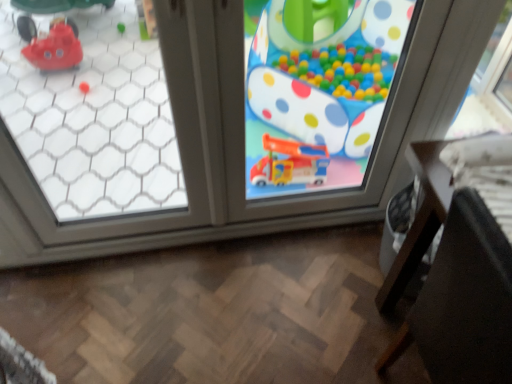
Describe the element at coordinates (94, 119) in the screenshot. I see `transparent glass window at upper left, placed as the 2th window when sorted from right to left` at that location.

The image size is (512, 384). What do you see at coordinates (319, 91) in the screenshot?
I see `matte plastic toy at center` at bounding box center [319, 91].

What do you see at coordinates (464, 302) in the screenshot? I see `black leather chair at lower right` at bounding box center [464, 302].

Where is `transparent glass window at upper left, placed as the 2th window when sorted from right to left`? Image resolution: width=512 pixels, height=384 pixels. transparent glass window at upper left, placed as the 2th window when sorted from right to left is located at coordinates (94, 119).

From a real-world perspective, who is located lower, transparent glass window at upper left, placed as the 2th window when sorted from right to left, or black leather chair at lower right?

black leather chair at lower right, from a real-world perspective.

Relative to black leather chair at lower right, is transparent glass window at upper left, which is the first window from left to right, in front or behind?

In the image, transparent glass window at upper left, which is the first window from left to right, appears behind black leather chair at lower right.

Looking at this image, who is shorter, transparent glass window at upper left, which is the first window from left to right, or black leather chair at lower right?

Standing shorter between the two is black leather chair at lower right.

Could black leather chair at lower right be considered to be inside transparent glass window at center, the second window in the left-to-right sequence?

Actually, black leather chair at lower right is outside transparent glass window at center, the second window in the left-to-right sequence.

From a real-world perspective, is transparent glass window at center, the 1th window when ordered from right to left, positioned under black leather chair at lower right based on gravity?

No, from a real-world perspective, transparent glass window at center, the 1th window when ordered from right to left, is not below black leather chair at lower right.

In the scene shown: Is transparent glass window at center, the second window in the left-to-right sequence, oriented away from black leather chair at lower right?

No, transparent glass window at center, the second window in the left-to-right sequence, is not facing away from black leather chair at lower right.

Based on the photo, considering the relative positions of black leather chair at lower right and transparent glass window at upper left, placed as the 2th window when sorted from right to left, in the image provided, is black leather chair at lower right to the left or to the right of transparent glass window at upper left, placed as the 2th window when sorted from right to left,?

In the image, black leather chair at lower right appears on the right side of transparent glass window at upper left, placed as the 2th window when sorted from right to left.

Which of these two, black leather chair at lower right or transparent glass window at upper left, placed as the 2th window when sorted from right to left, is thinner?

With smaller width is transparent glass window at upper left, placed as the 2th window when sorted from right to left.

In the scene shown: Would you say transparent glass window at upper left, placed as the 2th window when sorted from right to left, is part of black leather chair at lower right's contents?

Actually, transparent glass window at upper left, placed as the 2th window when sorted from right to left, is outside black leather chair at lower right.

From the image's perspective, which one is positioned higher, black leather chair at lower right or transparent glass window at upper left, placed as the 2th window when sorted from right to left?

transparent glass window at upper left, placed as the 2th window when sorted from right to left, from the image's perspective.

Can you confirm if transparent glass window at upper left, which is the first window from left to right, is positioned to the right of matte plastic toy at center?

Incorrect, transparent glass window at upper left, which is the first window from left to right, is not on the right side of matte plastic toy at center.

Between transparent glass window at upper left, placed as the 2th window when sorted from right to left, and matte plastic toy at center, which one is positioned in front?

Positioned in front is transparent glass window at upper left, placed as the 2th window when sorted from right to left.

Which is farther, (x=119, y=17) or (x=346, y=67)?

Positioned behind is point (x=119, y=17).

Which of these two, matte plastic toy at center or transparent glass window at upper left, placed as the 2th window when sorted from right to left, is smaller?

With smaller size is transparent glass window at upper left, placed as the 2th window when sorted from right to left.

Which is in front, point (261, 134) or point (48, 194)?

The point (48, 194) is in front.

From the image's perspective, between matte plastic toy at center and transparent glass window at upper left, placed as the 2th window when sorted from right to left, who is located below?

transparent glass window at upper left, placed as the 2th window when sorted from right to left, is shown below in the image.

How distant is matte plastic toy at center from transparent glass window at upper left, which is the first window from left to right?

matte plastic toy at center is 32.87 inches away from transparent glass window at upper left, which is the first window from left to right.

Which point is more distant from viewer, (8, 86) or (438, 11)?

Point (8, 86)

You are a GUI agent. You are given a task and a screenshot of the screen. Output one action in this format:
    pyautogui.click(x=<x>, y=<y>)
    Task: Click on the window in front of the transparent glass window at center, the second window in the left-to-right sequence
    The height and width of the screenshot is (384, 512).
    Given the screenshot: What is the action you would take?
    pyautogui.click(x=94, y=119)

Who is more distant, transparent glass window at upper left, placed as the 2th window when sorted from right to left, or transparent glass window at center, the second window in the left-to-right sequence?

transparent glass window at center, the second window in the left-to-right sequence, is behind.

Would you consider matte plastic toy at center to be distant from black leather chair at lower right?

matte plastic toy at center is positioned a significant distance from black leather chair at lower right.

Between point (303, 57) and point (424, 349), which one is positioned in front?

Point (424, 349)

From a real-world perspective, which is physically below, matte plastic toy at center or black leather chair at lower right?

black leather chair at lower right, from a real-world perspective.

Considering the sizes of objects matte plastic toy at center and black leather chair at lower right in the image provided, who is thinner, matte plastic toy at center or black leather chair at lower right?

matte plastic toy at center is thinner.

Find the location of a particular element. The image size is (512, 384). chair below the transparent glass window at upper left, placed as the 2th window when sorted from right to left (from a real-world perspective) is located at coordinates (464, 302).

The width and height of the screenshot is (512, 384). What are the coordinates of `the 1st window above the black leather chair at lower right (from a real-world perspective)` in the screenshot? It's located at (223, 123).

Looking at the image, which one is located further to transparent glass window at center, the 1th window when ordered from right to left, transparent glass window at upper left, which is the first window from left to right, or black leather chair at lower right?

Based on the image, black leather chair at lower right appears to be further to transparent glass window at center, the 1th window when ordered from right to left.

When comparing their distances from black leather chair at lower right, does transparent glass window at center, the 1th window when ordered from right to left, or matte plastic toy at center seem further?

matte plastic toy at center.

Based on their spatial positions, is matte plastic toy at center or transparent glass window at center, the second window in the left-to-right sequence, closer to transparent glass window at upper left, placed as the 2th window when sorted from right to left?

transparent glass window at center, the second window in the left-to-right sequence, is positioned closer to the anchor transparent glass window at upper left, placed as the 2th window when sorted from right to left.

Based on their spatial positions, is transparent glass window at upper left, which is the first window from left to right, or matte plastic toy at center further from black leather chair at lower right?

transparent glass window at upper left, which is the first window from left to right, lies further to black leather chair at lower right than the other object.

Considering their positions, is matte plastic toy at center positioned closer to black leather chair at lower right than transparent glass window at upper left, which is the first window from left to right?

matte plastic toy at center.

Estimate the real-world distances between objects in this image. Which object is closer to transparent glass window at upper left, which is the first window from left to right, transparent glass window at center, the 1th window when ordered from right to left, or black leather chair at lower right?

transparent glass window at center, the 1th window when ordered from right to left, is positioned closer to the anchor transparent glass window at upper left, which is the first window from left to right.

In the scene shown: Looking at the image, which one is located closer to matte plastic toy at center, transparent glass window at center, the second window in the left-to-right sequence, or black leather chair at lower right?

transparent glass window at center, the second window in the left-to-right sequence.

Based on their spatial positions, is matte plastic toy at center or transparent glass window at upper left, placed as the 2th window when sorted from right to left, further from transparent glass window at center, the 1th window when ordered from right to left?

matte plastic toy at center is further to transparent glass window at center, the 1th window when ordered from right to left.

Find the location of a particular element. Image resolution: width=512 pixels, height=384 pixels. toy situated between transparent glass window at upper left, which is the first window from left to right, and black leather chair at lower right from left to right is located at coordinates (319, 91).

Identify the location of window between transparent glass window at upper left, placed as the 2th window when sorted from right to left, and matte plastic toy at center. The width and height of the screenshot is (512, 384). (223, 123).

This screenshot has width=512, height=384. I want to click on window located between transparent glass window at upper left, which is the first window from left to right, and black leather chair at lower right in the left-right direction, so click(x=223, y=123).

Image resolution: width=512 pixels, height=384 pixels. Find the location of `toy between transparent glass window at center, the second window in the left-to-right sequence, and black leather chair at lower right`. toy between transparent glass window at center, the second window in the left-to-right sequence, and black leather chair at lower right is located at coordinates (319, 91).